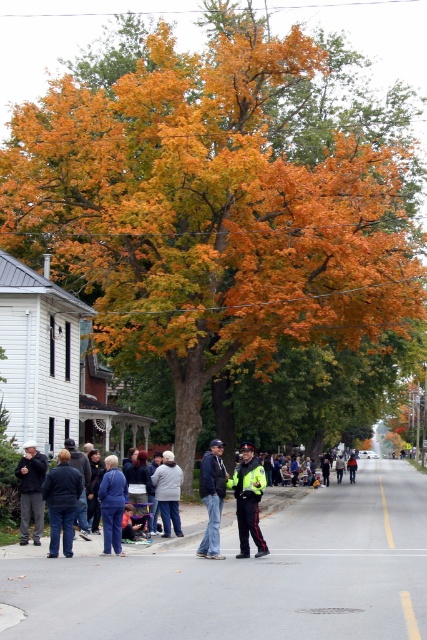
Who is more forward, (125,556) or (259,531)?

Positioned in front is point (259,531).

Which of these two, dark blue jeans at left or reflective yellow jacket at center, stands taller?

dark blue jeans at left

Is point (219, 506) farther from camera compared to point (260, 548)?

Yes, it is.

Locate an element on the screen. The image size is (427, 640). dark blue jeans at left is located at coordinates (108, 528).

Who is positioned more to the left, blue denim jacket at lower left or light blue denim jacket at center?

blue denim jacket at lower left is more to the left.

Is point (108, 513) behind point (348, 464)?

No, it is in front of (348, 464).

Where is `blue denim jacket at lower left`? Image resolution: width=427 pixels, height=640 pixels. blue denim jacket at lower left is located at coordinates (111, 504).

Can you confirm if dark blue jeans at center is smaller than light blue denim jacket at center?

Yes.

Does dark blue jeans at center have a lesser height compared to light blue denim jacket at center?

Incorrect, dark blue jeans at center's height does not fall short of light blue denim jacket at center's.

At what (x,y) coordinates should I click in order to perform the action: click on dark blue jeans at center. Please return your answer as a coordinate pair (x, y). Looking at the image, I should click on (211, 497).